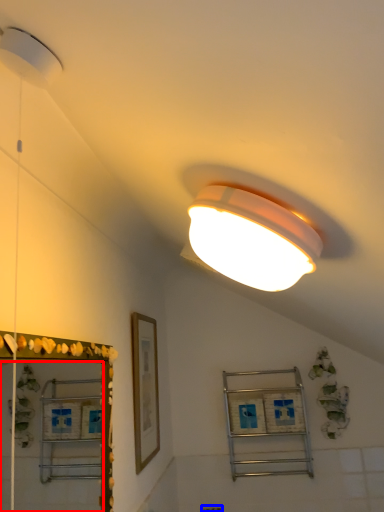
Question: Which point is closer to the camera, mirror (highlighted by a red box) or electric outlet (highlighted by a blue box)?

Choices:
 (A) mirror
 (B) electric outlet

Answer: (A)